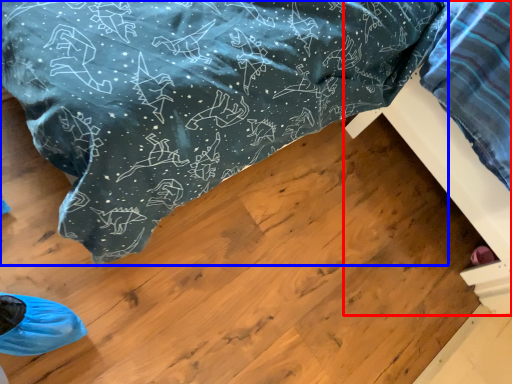
Question: Which of the following is the farthest to the observer, furniture (highlighted by a red box) or furniture (highlighted by a blue box)?

Choices:
 (A) furniture
 (B) furniture

Answer: (B)